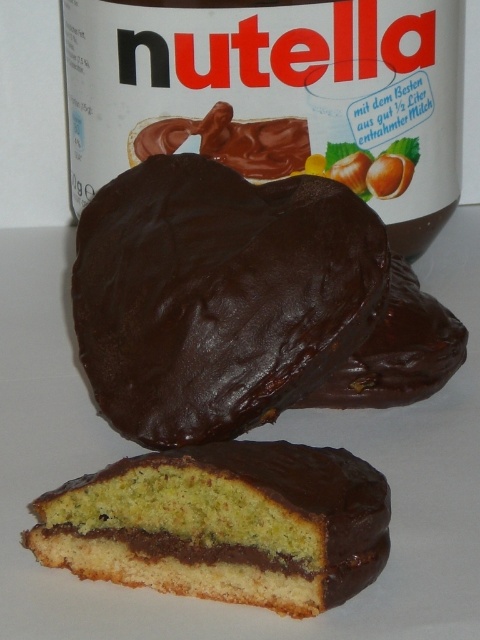
Find the location of a particular element. shiny dark chocolate cake at center is located at coordinates (218, 296).

Consider the image. Does shiny dark chocolate cake at center have a larger size compared to chocolate-coated cake at center?

Indeed, shiny dark chocolate cake at center has a larger size compared to chocolate-coated cake at center.

Which is behind, point (261, 228) or point (256, 525)?

Point (261, 228)

Locate an element on the screen. This screenshot has height=640, width=480. shiny dark chocolate cake at center is located at coordinates (218, 296).